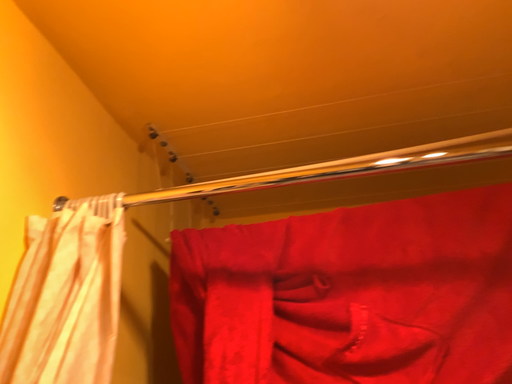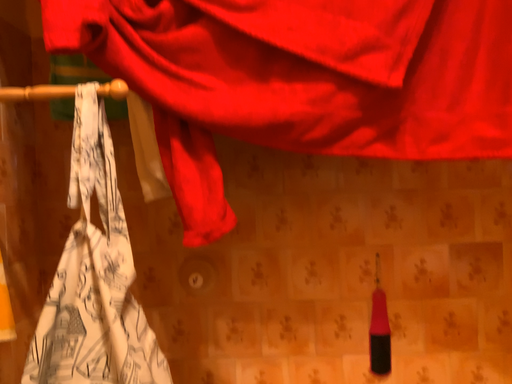
Question: Which way did the camera rotate in the video?

Choices:
 (A) rotated downward
 (B) rotated upward

Answer: (A)